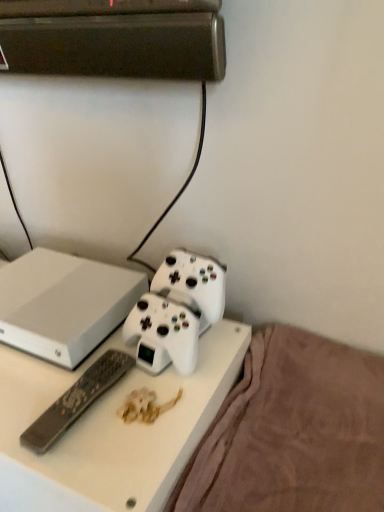
Locate an element on the screen. vacant area that is in front of black plastic remote at lower left is located at coordinates (95, 464).